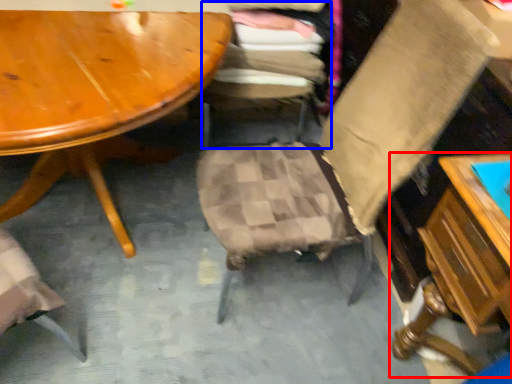
Question: Which point is further to the camera, table (highlighted by a red box) or chair (highlighted by a blue box)?

Choices:
 (A) table
 (B) chair

Answer: (B)